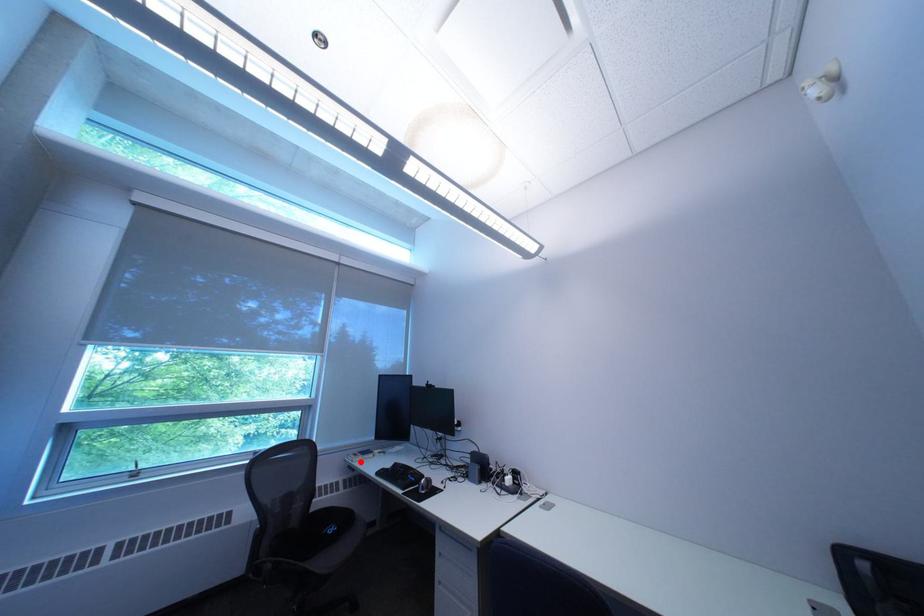
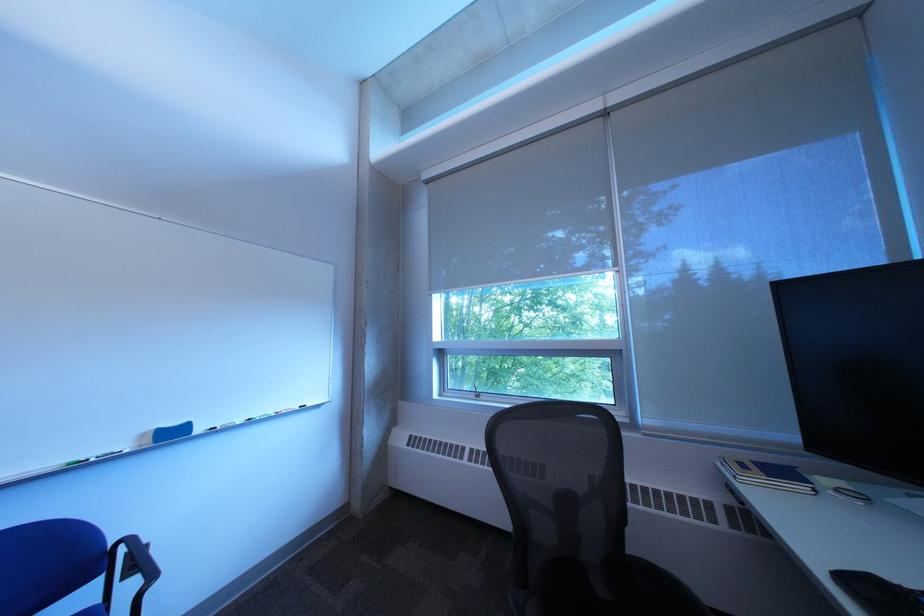
The point at the highlighted location is marked in the first image. Where is the corresponding point in the second image?

(733, 468)